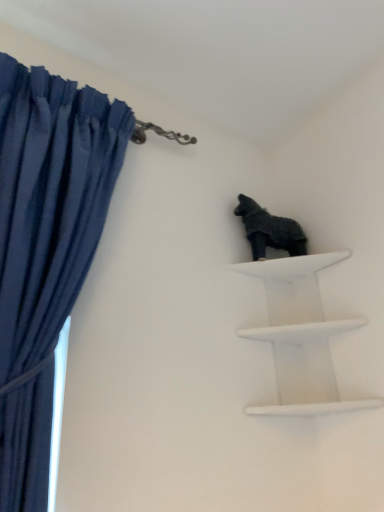
Question: Considering the positions of shiny black statue at upper right and white matte shelf at upper right in the image, is shiny black statue at upper right wider or thinner than white matte shelf at upper right?

Choices:
 (A) wide
 (B) thin

Answer: (B)

Question: Does point (289, 225) appear closer or farther from the camera than point (289, 333)?

Choices:
 (A) closer
 (B) farther

Answer: (B)

Question: Based on their relative distances, which object is farther from the shiny black statue at upper right?

Choices:
 (A) white matte shelf at upper right
 (B) dark blue fabric at left

Answer: (B)

Question: Which is farther from the dark blue fabric at left?

Choices:
 (A) shiny black statue at upper right
 (B) white matte shelf at upper right

Answer: (B)